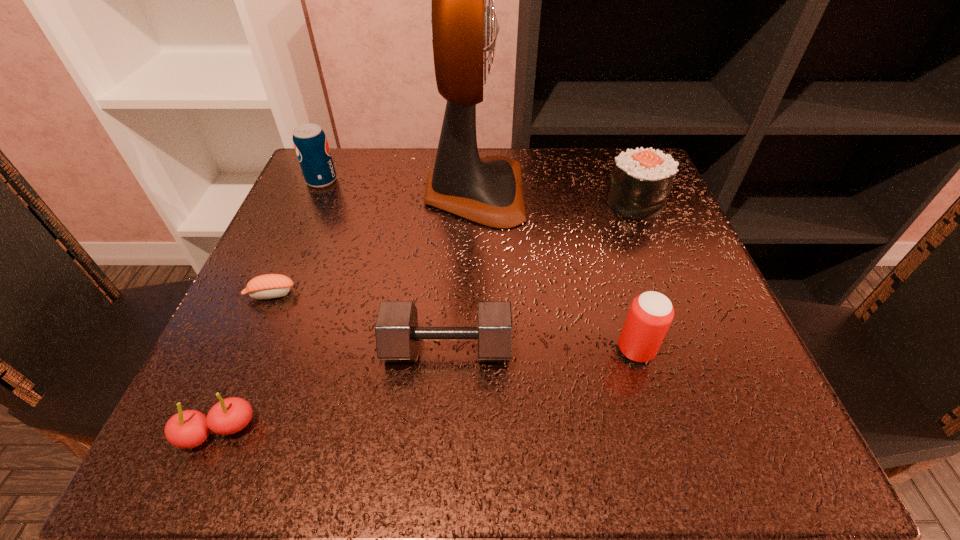
This screenshot has height=540, width=960. I want to click on free space between the farther sushi and the beer can, so click(x=636, y=277).

At what (x,y) coordinates should I click in order to perform the action: click on vacant space that's between the tallest object and the pop. Please return your answer as a coordinate pair (x, y). The image size is (960, 540). Looking at the image, I should click on (398, 186).

In order to click on free spot between the right sushi and the dumbbell in this screenshot , I will do `click(541, 276)`.

You are a GUI agent. You are given a task and a screenshot of the screen. Output one action in this format:
    pyautogui.click(x=<x>, y=<y>)
    Task: Click on the empty location between the dumbbell and the pop
    
    Given the screenshot: What is the action you would take?
    pyautogui.click(x=385, y=265)

Point out which object is positioned as the third nearest to the taller sushi. Please provide its 2D coordinates. Your answer should be formatted as a tuple, i.e. [(x, y)], where the tuple contains the x and y coordinates of a point satisfying the conditions above.

[(397, 333)]

Select which object appears as the fourth closest to the beer can. Please provide its 2D coordinates. Your answer should be formatted as a tuple, i.e. [(x, y)], where the tuple contains the x and y coordinates of a point satisfying the conditions above.

[(187, 429)]

Identify the location of vacant space that satisfies the following two spatial constraints: 1. on the front-facing side of the tallest object; 2. on the back side of the taller sushi. This screenshot has height=540, width=960. (474, 204).

Locate an element on the screen. The width and height of the screenshot is (960, 540). vacant space that satisfies the following two spatial constraints: 1. on the front-facing side of the tallest object; 2. on the right side of the taller sushi is located at coordinates (474, 204).

Locate an element on the screen. This screenshot has width=960, height=540. free location that satisfies the following two spatial constraints: 1. on the front-facing side of the fan; 2. on the left side of the beer can is located at coordinates (472, 350).

You are a GUI agent. You are given a task and a screenshot of the screen. Output one action in this format:
    pyautogui.click(x=<x>, y=<y>)
    Task: Click on the vacant space that satisfies the following two spatial constraints: 1. on the back side of the taller sushi; 2. on the left side of the fourth nearest object
    
    Given the screenshot: What is the action you would take?
    pyautogui.click(x=310, y=204)